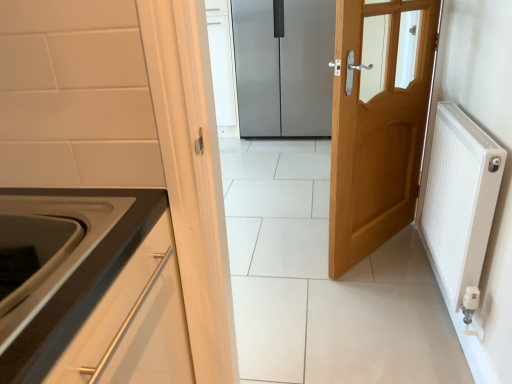
Locate an element on the screen. vacant space in front of light wood door at center, acting as the first door starting from the front is located at coordinates (385, 295).